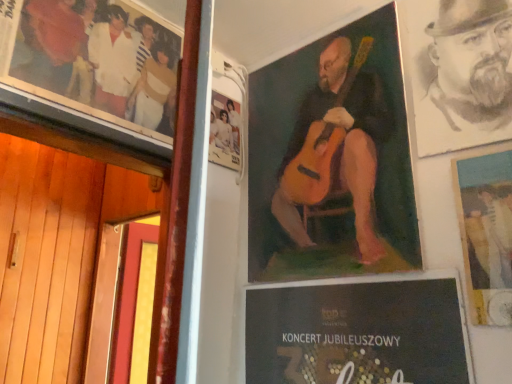
Question: Visually, is oil painting guitar at center, which is counted as the 2th poster, starting from the right, positioned to the left or to the right of vintage photo album at upper left, acting as the 3th poster starting from the right?

Choices:
 (A) right
 (B) left

Answer: (A)

Question: Choose the correct answer: Is oil painting guitar at center, which is counted as the 2th poster, starting from the right, inside vintage photo album at upper left, acting as the 3th poster starting from the right, or outside it?

Choices:
 (A) inside
 (B) outside

Answer: (B)

Question: Estimate the real-world distances between objects in this image. Which object is farther from the oil painting guitar at center, which is counted as the 2th poster, starting from the right?

Choices:
 (A) charcoal sketch of man at upper right
 (B) vintage photo album at upper left, the 1th poster in the left-to-right sequence
 (C) matte paper poster at upper right, the 3th poster from the left

Answer: (B)

Question: Which is nearer to the charcoal sketch of man at upper right?

Choices:
 (A) oil painting guitar at center, which is counted as the 2th poster, starting from the right
 (B) vintage photo album at upper left, the 1th poster in the left-to-right sequence
 (C) matte paper poster at upper right, the 3th poster from the left

Answer: (C)